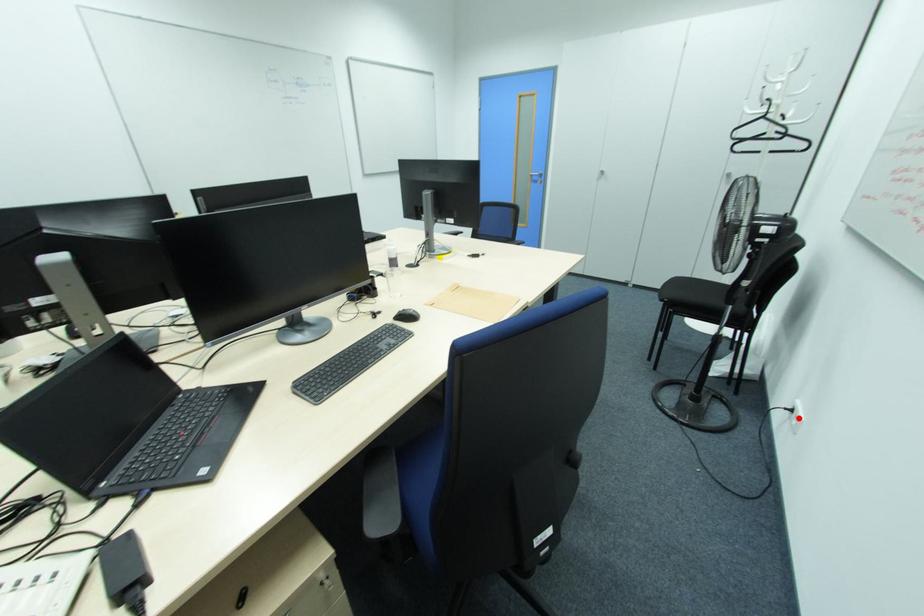
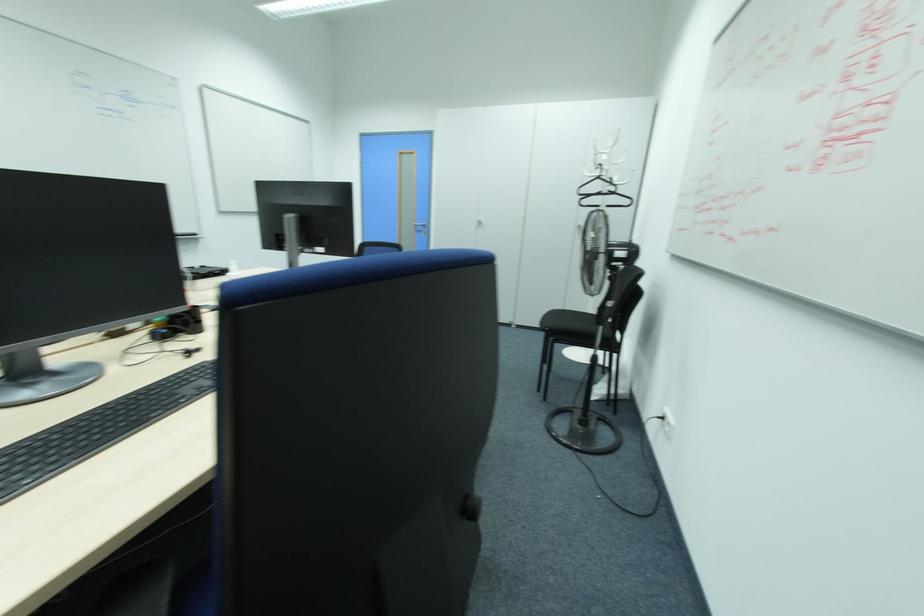
Find the pixel in the second image that matches the highlighted location in the first image.

(670, 424)